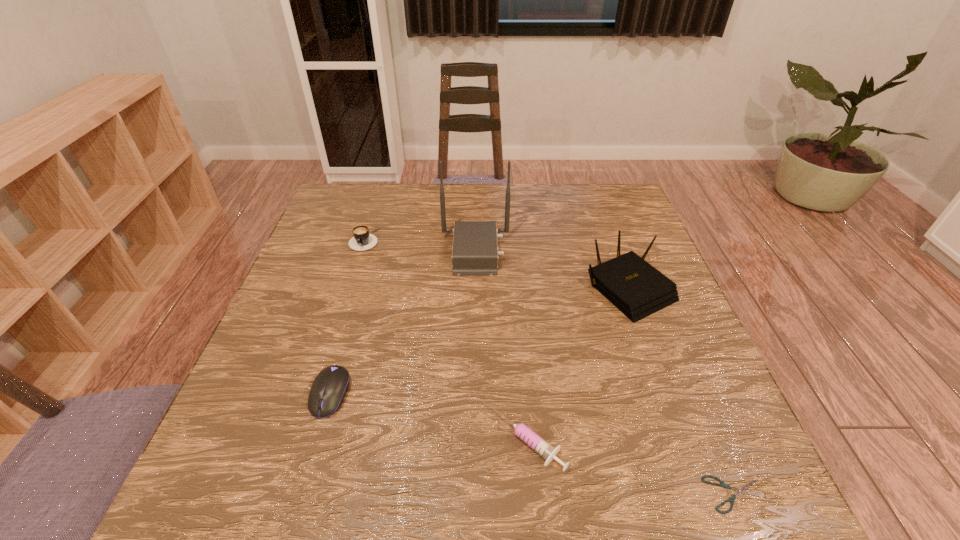
Find the location of `vacant space situated on the back of the right router`. vacant space situated on the back of the right router is located at coordinates (606, 226).

In order to click on free space located with the handle on the side of the third tallest object in this screenshot , I will do `click(325, 361)`.

Locate an element on the screen. Image resolution: width=960 pixels, height=540 pixels. free location located 0.240m on the back of the computer mouse is located at coordinates (361, 291).

Where is `free region located on the right of the fifth tallest object`? free region located on the right of the fifth tallest object is located at coordinates (734, 440).

What are the coordinates of `blank space located on the left of the shortest object` in the screenshot? It's located at (664, 494).

The image size is (960, 540). In order to click on syringe located in the near edge section of the desktop in this screenshot , I will do `click(543, 448)`.

Locate an element on the screen. shears that is at the near edge is located at coordinates (743, 489).

At what (x,y) coordinates should I click in order to perform the action: click on cappuccino located at the left edge. Please return your answer as a coordinate pair (x, y). The height and width of the screenshot is (540, 960). Looking at the image, I should click on (362, 240).

You are a GUI agent. You are given a task and a screenshot of the screen. Output one action in this format:
    pyautogui.click(x=<x>, y=<y>)
    Task: Click on the computer mouse located at the left edge
    This screenshot has width=960, height=540.
    Given the screenshot: What is the action you would take?
    pyautogui.click(x=329, y=388)

This screenshot has width=960, height=540. In order to click on router that is at the right edge in this screenshot , I will do `click(636, 288)`.